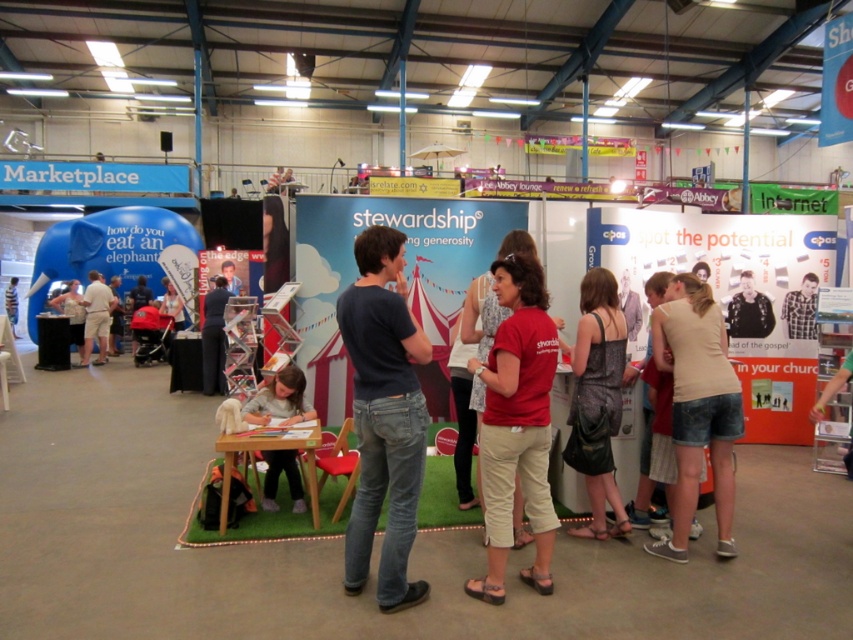
From the picture: You are attending an event and want to find the person wearing the black textured dress at center and light beige shorts at center. Based on the scene description, where would you look relative to these two items?

The black textured dress at center is below the light beige shorts at center, so you should look downward from the light beige shorts at center to find the black textured dress at center.